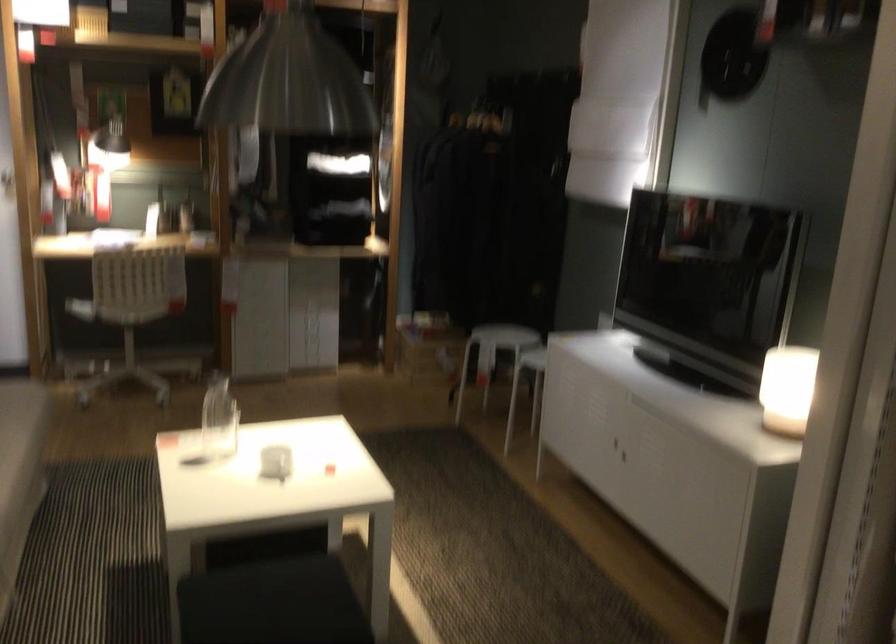
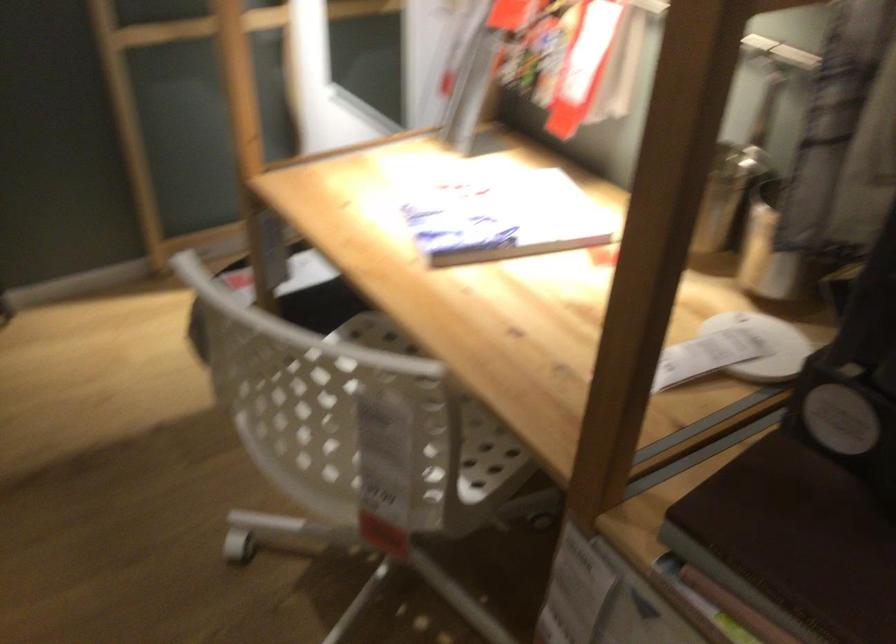
Find the pixel in the second image that matches point 243,182 in the first image.

(771, 252)